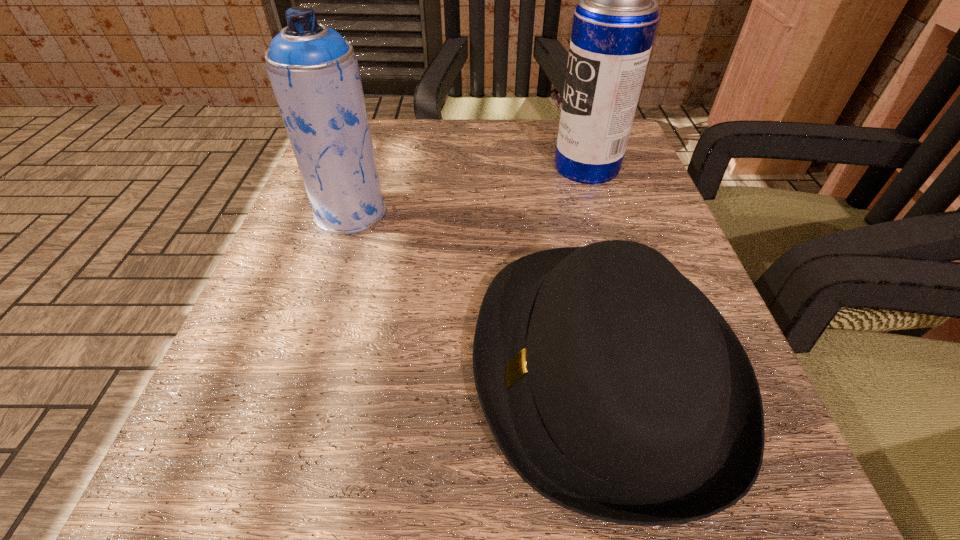
Image resolution: width=960 pixels, height=540 pixels. In order to click on vacant space at the far edge of the desktop in this screenshot , I will do tap(433, 124).

Where is `free space at the near edge`? The width and height of the screenshot is (960, 540). free space at the near edge is located at coordinates (335, 538).

The width and height of the screenshot is (960, 540). Find the location of `vacant space at the left edge of the desktop`. vacant space at the left edge of the desktop is located at coordinates (316, 384).

This screenshot has width=960, height=540. In order to click on vacant point at the right edge in this screenshot , I will do `click(572, 191)`.

In the image, there is a desktop. Where is `vacant area at the far left corner`? This screenshot has width=960, height=540. vacant area at the far left corner is located at coordinates (397, 123).

You are a GUI agent. You are given a task and a screenshot of the screen. Output one action in this format:
    pyautogui.click(x=<x>, y=<y>)
    Task: Click on the free space at the near left corner of the desktop
    Image resolution: width=960 pixels, height=540 pixels.
    Given the screenshot: What is the action you would take?
    297,472

Image resolution: width=960 pixels, height=540 pixels. Identify the location of vacant space at the far right corner of the desktop. (637, 164).

What are the coordinates of `free space between the second farthest object and the farthest object` in the screenshot? It's located at (468, 190).

Locate an element on the screen. free space between the fedora and the nearer aerosol can is located at coordinates (477, 289).

This screenshot has height=540, width=960. Identify the location of blank region between the leftmost object and the fedora. (477, 289).